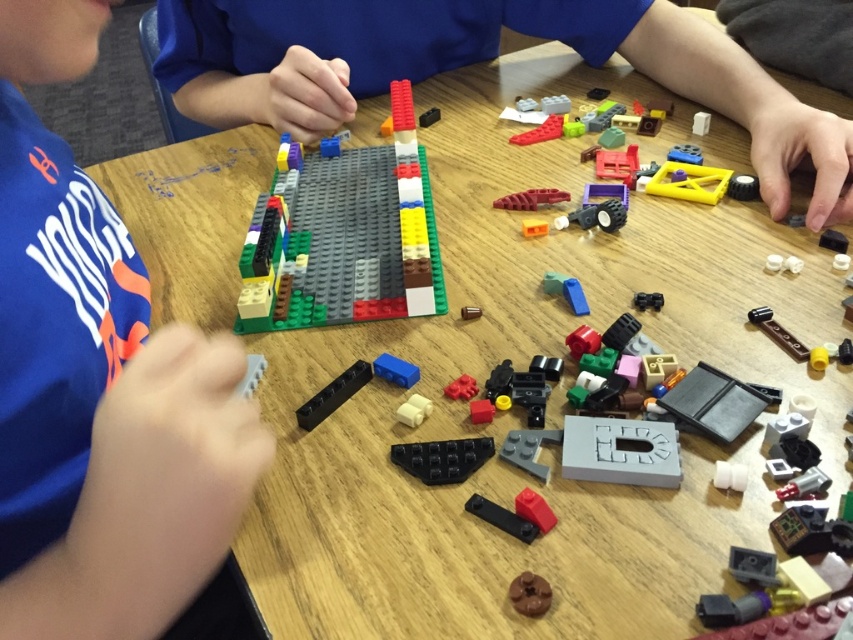
You are a LEGO enthusiast trying to assemble a model. You have two pieces in front of you on the table, the black plastic brick at center and the orange plastic lever at center. Which piece should you place first if the instructions specify that larger pieces form the base structure?

The black plastic brick at center is larger in size than the orange plastic lever at center, so you should place the black plastic brick at center first as it is part of the base structure.

Consider the image. You are trying to place a LEGO piece between the two points, point (x=579, y=300) and point (x=387, y=376). Which point is closer to you so you can reach it first?

Point (x=387, y=376) is closer to you, so you can reach it first.